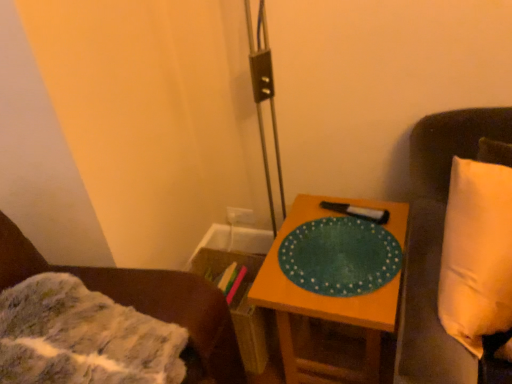
Question: Is green matte placemat at center bigger than fuzzy fabric blanket at lower left, which appears as the 1th furniture when viewed from the left?

Choices:
 (A) no
 (B) yes

Answer: (B)

Question: Is there a large distance between green matte placemat at center and fuzzy fabric blanket at lower left, which appears as the 1th furniture when viewed from the left?

Choices:
 (A) yes
 (B) no

Answer: (B)

Question: Would you say fuzzy fabric blanket at lower left, which appears as the 2th furniture when viewed from the right, is part of green matte placemat at center's contents?

Choices:
 (A) yes
 (B) no

Answer: (B)

Question: Is green matte placemat at center smaller than fuzzy fabric blanket at lower left, which appears as the 1th furniture when viewed from the left?

Choices:
 (A) no
 (B) yes

Answer: (A)

Question: Is green matte placemat at center further to camera compared to fuzzy fabric blanket at lower left, which appears as the 1th furniture when viewed from the left?

Choices:
 (A) no
 (B) yes

Answer: (B)

Question: Is green matte platter at center-right in front of or behind white fabric pillow at right, which ranks as the second furniture in left-to-right order, in the image?

Choices:
 (A) behind
 (B) front

Answer: (A)

Question: Is point (380, 283) positioned closer to the camera than point (418, 157)?

Choices:
 (A) farther
 (B) closer

Answer: (B)

Question: Looking at their shapes, would you say green matte platter at center-right is wider or thinner than white fabric pillow at right, which ranks as the second furniture in left-to-right order?

Choices:
 (A) thin
 (B) wide

Answer: (A)

Question: Considering the relative positions of green matte platter at center-right and white fabric pillow at right, which ranks as the second furniture in left-to-right order, in the image provided, is green matte platter at center-right to the left or to the right of white fabric pillow at right, which ranks as the second furniture in left-to-right order,?

Choices:
 (A) right
 (B) left

Answer: (B)

Question: Visually, is white fabric pillow at right, which is the 1th furniture in right-to-left order, positioned to the left or to the right of fuzzy fabric blanket at lower left, which appears as the 2th furniture when viewed from the right?

Choices:
 (A) right
 (B) left

Answer: (A)

Question: Relative to fuzzy fabric blanket at lower left, which appears as the 2th furniture when viewed from the right, is white fabric pillow at right, which ranks as the second furniture in left-to-right order, in front or behind?

Choices:
 (A) behind
 (B) front

Answer: (A)

Question: From the image's perspective, is white fabric pillow at right, which is the 1th furniture in right-to-left order, positioned above or below fuzzy fabric blanket at lower left, which appears as the 2th furniture when viewed from the right?

Choices:
 (A) above
 (B) below

Answer: (A)

Question: Considering the positions of white fabric pillow at right, which is the 1th furniture in right-to-left order, and fuzzy fabric blanket at lower left, which appears as the 2th furniture when viewed from the right, in the image, is white fabric pillow at right, which is the 1th furniture in right-to-left order, bigger or smaller than fuzzy fabric blanket at lower left, which appears as the 2th furniture when viewed from the right,?

Choices:
 (A) small
 (B) big

Answer: (B)

Question: Does point (22, 269) appear closer or farther from the camera than point (435, 223)?

Choices:
 (A) closer
 (B) farther

Answer: (A)

Question: Is fuzzy fabric blanket at lower left, which appears as the 1th furniture when viewed from the left, to the left or to the right of white fabric pillow at right, which ranks as the second furniture in left-to-right order, in the image?

Choices:
 (A) left
 (B) right

Answer: (A)